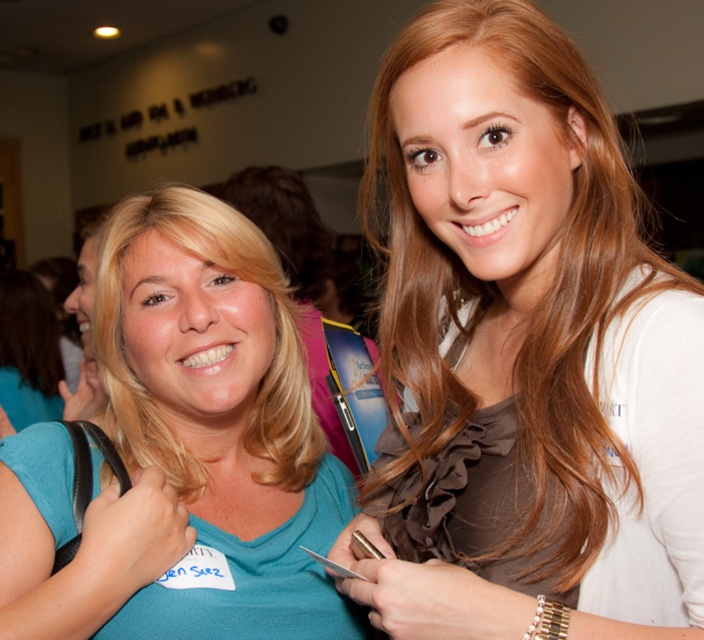
You are standing in the room and want to locate the teal matte shirt at center. According to the coordinates given, where would you find it?

The teal matte shirt at center is located at coordinates point (218, 422).

You are organizing a photo shoot and need to ensure that the two models, wearing the matte brown blouse at center and the teal matte shirt at center, are positioned at least 12 inches apart for proper lighting. Based on the current setup, can they maintain the required distance?

The distance between the matte brown blouse at center and the teal matte shirt at center is 10.54 inches, which is less than the required 12 inches. They need to move farther apart to meet the distance requirement.